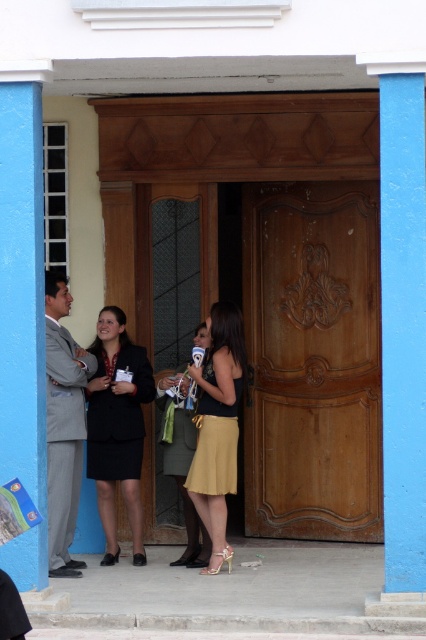
Question: Which point is closer to the camera?

Choices:
 (A) (186, 387)
 (B) (98, 358)

Answer: (A)

Question: Does gray suit at left appear under matte yellow skirt at center?

Choices:
 (A) yes
 (B) no

Answer: (B)

Question: Considering the relative positions of black fabric skirt at center and matte yellow skirt at center in the image provided, where is black fabric skirt at center located with respect to matte yellow skirt at center?

Choices:
 (A) left
 (B) right

Answer: (A)

Question: Which point is farther to the camera?

Choices:
 (A) (249, 248)
 (B) (215, 456)
 (C) (97, 381)
 (D) (69, 572)

Answer: (A)

Question: Can you confirm if gray suit at left is positioned to the left of matte yellow skirt at center?

Choices:
 (A) no
 (B) yes

Answer: (B)

Question: Which object appears farthest from the camera in this image?

Choices:
 (A) gold satin dress at center
 (B) gray suit at left
 (C) wooden carved door at center

Answer: (C)